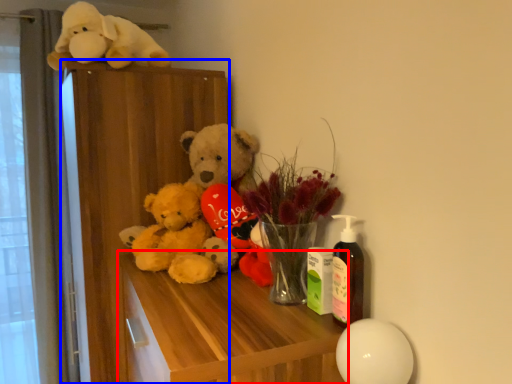
Question: Among these objects, which one is nearest to the camera, table (highlighted by a red box) or dresser (highlighted by a blue box)?

Choices:
 (A) table
 (B) dresser

Answer: (A)